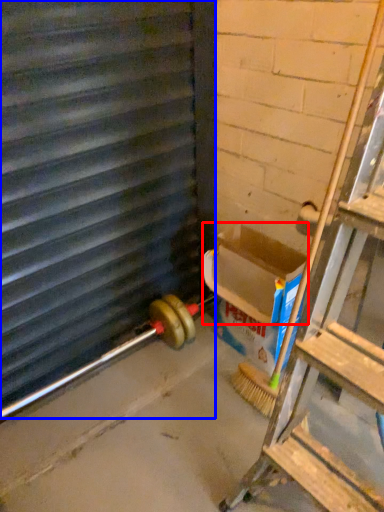
Question: Which object appears farthest to the camera in this image, box (highlighted by a red box) or window frame (highlighted by a blue box)?

Choices:
 (A) box
 (B) window frame

Answer: (A)